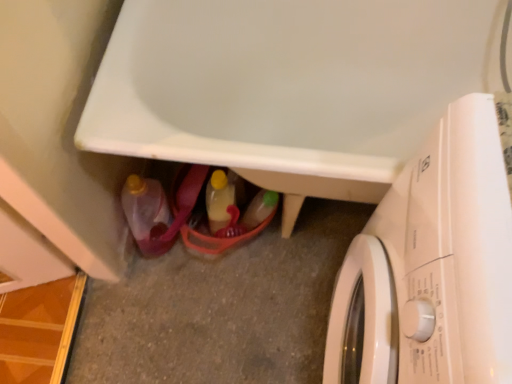
Image resolution: width=512 pixels, height=384 pixels. Find the location of `translucent plastic bottle at center, acting as the second bottle starting from the left`. translucent plastic bottle at center, acting as the second bottle starting from the left is located at coordinates (219, 200).

What is the approximate width of white glossy washing machine at lower right?

The width of white glossy washing machine at lower right is 58.86 centimeters.

Image resolution: width=512 pixels, height=384 pixels. Describe the element at coordinates (434, 263) in the screenshot. I see `white glossy washing machine at lower right` at that location.

Describe the element at coordinates (289, 86) in the screenshot. I see `white glossy bathtub at lower center` at that location.

Locate an element on the screen. The image size is (512, 384). translucent plastic bottle at center, marked as the 1th bottle in a right-to-left arrangement is located at coordinates (219, 200).

Do you think translucent plastic bottle at center, acting as the second bottle starting from the left, is within white glossy bathtub at lower center, or outside of it?

translucent plastic bottle at center, acting as the second bottle starting from the left, is located inside white glossy bathtub at lower center.

Locate an element on the screen. the 2nd bottle behind the white glossy bathtub at lower center, counting from the anchor's position is located at coordinates (219, 200).

Does translucent plastic bottle at center, acting as the second bottle starting from the left, lie in front of white glossy bathtub at lower center?

No, the depth of translucent plastic bottle at center, acting as the second bottle starting from the left, is greater than that of white glossy bathtub at lower center.

Does point (225, 182) appear closer or farther from the camera than point (214, 34)?

Point (225, 182) is positioned farther from the camera compared to point (214, 34).

What are the coordinates of `bottle located behind the matte plastic bottle at lower left, which is the 1th bottle in left-to-right order` in the screenshot? It's located at (219, 200).

Which is behind, point (149, 194) or point (224, 177)?

The point (224, 177) is behind.

From the image's perspective, between matte plastic bottle at lower left, which is the 1th bottle in left-to-right order, and translucent plastic bottle at center, acting as the second bottle starting from the left, who is located below?

matte plastic bottle at lower left, which is the 1th bottle in left-to-right order.

Can you tell me how much matte plastic bottle at lower left, which appears as the second bottle when viewed from the right, and translucent plastic bottle at center, marked as the 1th bottle in a right-to-left arrangement, differ in facing direction?

matte plastic bottle at lower left, which appears as the second bottle when viewed from the right, and translucent plastic bottle at center, marked as the 1th bottle in a right-to-left arrangement, are facing 0.000374 degrees away from each other.

Between white glossy washing machine at lower right and translucent plastic bottle at center, marked as the 1th bottle in a right-to-left arrangement, which one appears on the right side from the viewer's perspective?

white glossy washing machine at lower right is more to the right.

From the image's perspective, which one is positioned higher, white glossy washing machine at lower right or translucent plastic bottle at center, acting as the second bottle starting from the left?

translucent plastic bottle at center, acting as the second bottle starting from the left, appears higher in the image.

Which object is further away from the camera taking this photo, white glossy washing machine at lower right or translucent plastic bottle at center, acting as the second bottle starting from the left?

translucent plastic bottle at center, acting as the second bottle starting from the left, is more distant.

From the picture: Looking at their sizes, would you say white glossy washing machine at lower right is wider or thinner than translucent plastic bottle at center, acting as the second bottle starting from the left?

In the image, white glossy washing machine at lower right appears to be wider than translucent plastic bottle at center, acting as the second bottle starting from the left.

Are matte plastic bottle at lower left, which appears as the second bottle when viewed from the right, and white glossy washing machine at lower right far apart?

They are positioned close to each other.

Does matte plastic bottle at lower left, which is the 1th bottle in left-to-right order, appear on the right side of white glossy washing machine at lower right?

Incorrect, matte plastic bottle at lower left, which is the 1th bottle in left-to-right order, is not on the right side of white glossy washing machine at lower right.

From the image's perspective, is matte plastic bottle at lower left, which is the 1th bottle in left-to-right order, located above or below white glossy washing machine at lower right?

From the image's perspective, matte plastic bottle at lower left, which is the 1th bottle in left-to-right order, appears above white glossy washing machine at lower right.

Is matte plastic bottle at lower left, which is the 1th bottle in left-to-right order, surrounding white glossy washing machine at lower right?

No, white glossy washing machine at lower right is not inside matte plastic bottle at lower left, which is the 1th bottle in left-to-right order.

From a real-world perspective, is white glossy washing machine at lower right positioned under matte plastic bottle at lower left, which appears as the second bottle when viewed from the right, based on gravity?

No, from a real-world perspective, white glossy washing machine at lower right is not beneath matte plastic bottle at lower left, which appears as the second bottle when viewed from the right.

Does point (387, 318) appear closer or farther from the camera than point (162, 234)?

Point (387, 318) is positioned closer to the camera compared to point (162, 234).

Can you tell me how much white glossy washing machine at lower right and matte plastic bottle at lower left, which is the 1th bottle in left-to-right order, differ in facing direction?

91.2 degrees separate the facing orientations of white glossy washing machine at lower right and matte plastic bottle at lower left, which is the 1th bottle in left-to-right order.

Are white glossy washing machine at lower right and matte plastic bottle at lower left, which appears as the second bottle when viewed from the right, making contact?

No, white glossy washing machine at lower right is not in contact with matte plastic bottle at lower left, which appears as the second bottle when viewed from the right.

Can you confirm if white glossy bathtub at lower center is shorter than white glossy washing machine at lower right?

Yes, white glossy bathtub at lower center is shorter than white glossy washing machine at lower right.

Is white glossy bathtub at lower center not within white glossy washing machine at lower right?

Yes, white glossy bathtub at lower center is not within white glossy washing machine at lower right.

Locate an element on the screen. washing machine below the white glossy bathtub at lower center (from the image's perspective) is located at coordinates (434, 263).

Measure the distance between white glossy bathtub at lower center and white glossy washing machine at lower right.

white glossy bathtub at lower center and white glossy washing machine at lower right are 16.50 inches apart from each other.

Can you see translucent plastic bottle at center, acting as the second bottle starting from the left, touching matte plastic bottle at lower left, which is the 1th bottle in left-to-right order?

No, translucent plastic bottle at center, acting as the second bottle starting from the left, is not in contact with matte plastic bottle at lower left, which is the 1th bottle in left-to-right order.

Which of these two, translucent plastic bottle at center, acting as the second bottle starting from the left, or matte plastic bottle at lower left, which appears as the second bottle when viewed from the right, is wider?

matte plastic bottle at lower left, which appears as the second bottle when viewed from the right.

From the picture: Does translucent plastic bottle at center, acting as the second bottle starting from the left, have a greater height compared to matte plastic bottle at lower left, which is the 1th bottle in left-to-right order?

Incorrect, the height of translucent plastic bottle at center, acting as the second bottle starting from the left, is not larger of that of matte plastic bottle at lower left, which is the 1th bottle in left-to-right order.

What's the angular difference between translucent plastic bottle at center, marked as the 1th bottle in a right-to-left arrangement, and matte plastic bottle at lower left, which appears as the second bottle when viewed from the right,'s facing directions?

They differ by 0.000374 degrees in their facing directions.

At what (x,y) coordinates should I click in order to perform the action: click on bath that appears above the translucent plastic bottle at center, acting as the second bottle starting from the left (from a real-world perspective). Please return your answer as a coordinate pair (x, y). This screenshot has width=512, height=384. Looking at the image, I should click on (289, 86).

Locate an element on the screen. Image resolution: width=512 pixels, height=384 pixels. bottle behind the matte plastic bottle at lower left, which appears as the second bottle when viewed from the right is located at coordinates (219, 200).

Consider the image. From the image, which object appears to be nearer to white glossy bathtub at lower center, white glossy washing machine at lower right or translucent plastic bottle at center, marked as the 1th bottle in a right-to-left arrangement?

The object closer to white glossy bathtub at lower center is translucent plastic bottle at center, marked as the 1th bottle in a right-to-left arrangement.

Which object lies nearer to the anchor point white glossy washing machine at lower right, translucent plastic bottle at center, acting as the second bottle starting from the left, or matte plastic bottle at lower left, which is the 1th bottle in left-to-right order?

The object closer to white glossy washing machine at lower right is translucent plastic bottle at center, acting as the second bottle starting from the left.

Which object lies further to the anchor point matte plastic bottle at lower left, which appears as the second bottle when viewed from the right, white glossy washing machine at lower right or translucent plastic bottle at center, acting as the second bottle starting from the left?

white glossy washing machine at lower right lies further to matte plastic bottle at lower left, which appears as the second bottle when viewed from the right, than the other object.

Considering their positions, is matte plastic bottle at lower left, which appears as the second bottle when viewed from the right, positioned closer to white glossy washing machine at lower right than translucent plastic bottle at center, acting as the second bottle starting from the left?

translucent plastic bottle at center, acting as the second bottle starting from the left, lies closer to white glossy washing machine at lower right than the other object.

From the picture: Estimate the real-world distances between objects in this image. Which object is closer to white glossy bathtub at lower center, translucent plastic bottle at center, acting as the second bottle starting from the left, or matte plastic bottle at lower left, which is the 1th bottle in left-to-right order?

Based on the image, translucent plastic bottle at center, acting as the second bottle starting from the left, appears to be nearer to white glossy bathtub at lower center.

Estimate the real-world distances between objects in this image. Which object is further from white glossy washing machine at lower right, matte plastic bottle at lower left, which is the 1th bottle in left-to-right order, or white glossy bathtub at lower center?

matte plastic bottle at lower left, which is the 1th bottle in left-to-right order.

Considering their positions, is matte plastic bottle at lower left, which is the 1th bottle in left-to-right order, positioned closer to white glossy bathtub at lower center than translucent plastic bottle at center, acting as the second bottle starting from the left?

Based on the image, translucent plastic bottle at center, acting as the second bottle starting from the left, appears to be nearer to white glossy bathtub at lower center.

Considering their positions, is white glossy bathtub at lower center positioned further to matte plastic bottle at lower left, which is the 1th bottle in left-to-right order, than white glossy washing machine at lower right?

white glossy washing machine at lower right is further to matte plastic bottle at lower left, which is the 1th bottle in left-to-right order.

Where is `bath between matte plastic bottle at lower left, which appears as the second bottle when viewed from the right, and white glossy washing machine at lower right, in the horizontal direction`? This screenshot has height=384, width=512. bath between matte plastic bottle at lower left, which appears as the second bottle when viewed from the right, and white glossy washing machine at lower right, in the horizontal direction is located at coordinates (289, 86).

Image resolution: width=512 pixels, height=384 pixels. Find the location of `bottle situated between matte plastic bottle at lower left, which appears as the second bottle when viewed from the right, and white glossy washing machine at lower right from left to right`. bottle situated between matte plastic bottle at lower left, which appears as the second bottle when viewed from the right, and white glossy washing machine at lower right from left to right is located at coordinates (219, 200).

Locate an element on the screen. The height and width of the screenshot is (384, 512). bottle between matte plastic bottle at lower left, which appears as the second bottle when viewed from the right, and white glossy bathtub at lower center, in the horizontal direction is located at coordinates (219, 200).

At what (x,y) coordinates should I click in order to perform the action: click on bath between white glossy washing machine at lower right and translucent plastic bottle at center, acting as the second bottle starting from the left, in the front-back direction. Please return your answer as a coordinate pair (x, y). The width and height of the screenshot is (512, 384). Looking at the image, I should click on (289, 86).